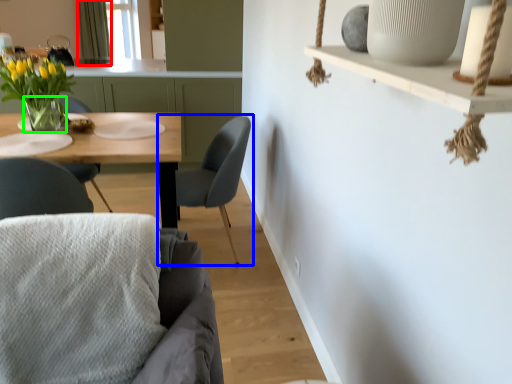
Question: Estimate the real-world distances between objects in this image. Which object is farther from curtain (highlighted by a red box), chair (highlighted by a blue box) or vase (highlighted by a green box)?

Choices:
 (A) chair
 (B) vase

Answer: (A)